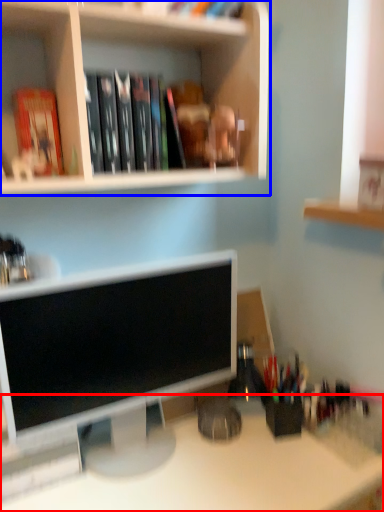
Question: Among these objects, which one is farthest to the camera, desk (highlighted by a red box) or shelf (highlighted by a blue box)?

Choices:
 (A) desk
 (B) shelf

Answer: (B)